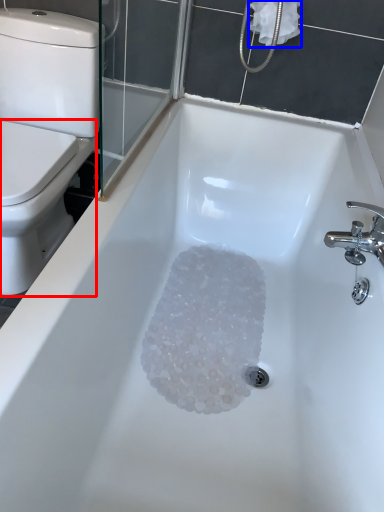
Question: Which object appears closest to the camera in this image, bidet (highlighted by a red box) or toilet paper (highlighted by a blue box)?

Choices:
 (A) bidet
 (B) toilet paper

Answer: (A)